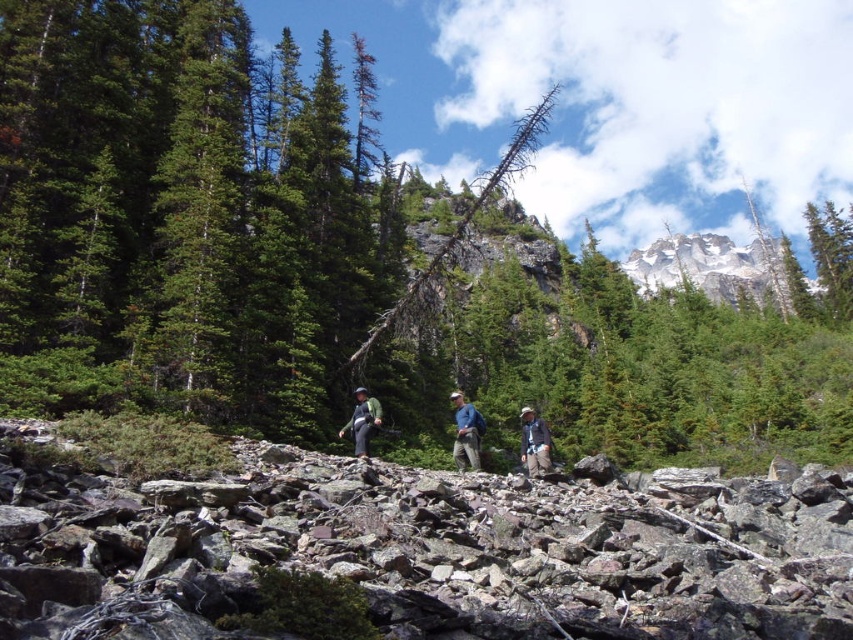
Question: Does gray rough rocks at center appear on the right side of green fabric backpack at center?

Choices:
 (A) no
 (B) yes

Answer: (B)

Question: Which of these objects is positioned farthest from the gray rough rocks at center?

Choices:
 (A) light blue fabric shirt at center
 (B) snowy granite peak at upper right

Answer: (B)

Question: Can you confirm if snowy granite peak at upper right is bigger than khaki pants at center?

Choices:
 (A) yes
 (B) no

Answer: (A)

Question: Which of these objects is positioned farthest from the gray rough rocks at center?

Choices:
 (A) snowy granite peak at upper right
 (B) green textured tree at center
 (C) green fabric backpack at center
 (D) khaki pants at center

Answer: (A)

Question: Is green textured tree at center closer to the viewer compared to gray rough rocks at center?

Choices:
 (A) yes
 (B) no

Answer: (B)

Question: Which point is farther to the camera?

Choices:
 (A) 39,298
 (B) 566,540
 (C) 537,428
 (D) 469,412

Answer: (A)